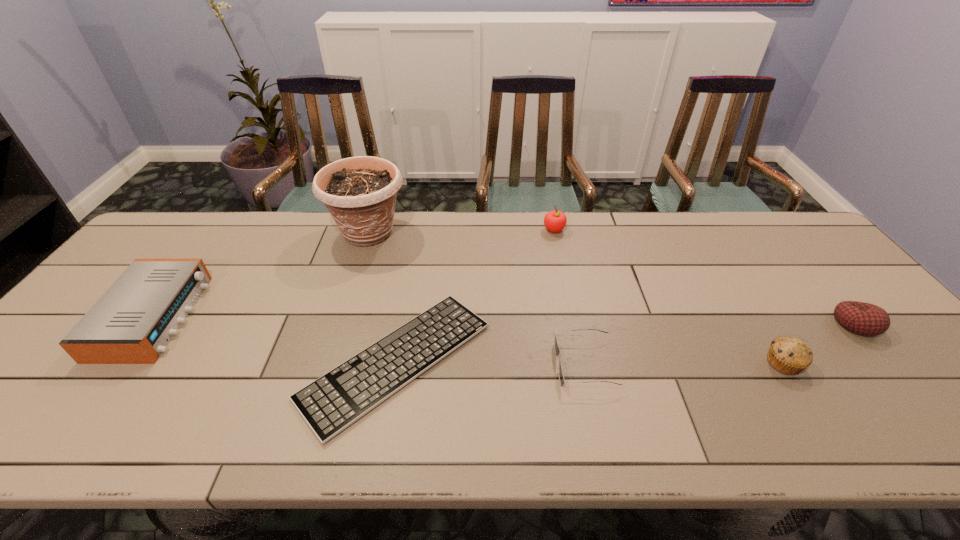
At what (x,y) coordinates should I click in order to perform the action: click on vacant space located 0.320m on the back of the muffin. Please return your answer as a coordinate pair (x, y). Looking at the image, I should click on (721, 264).

This screenshot has height=540, width=960. I want to click on vacant region located on the front of the beanbag, so click(x=883, y=357).

Locate an element on the screen. free space located on the front-facing side of the sixth tallest object is located at coordinates (510, 364).

Locate an element on the screen. The height and width of the screenshot is (540, 960). free location located on the front-facing side of the sixth tallest object is located at coordinates (506, 364).

Locate an element on the screen. The width and height of the screenshot is (960, 540). free space located 0.240m on the front-facing side of the sixth tallest object is located at coordinates (455, 364).

Identify the location of vacant space located 0.090m on the back of the computer keyboard. (412, 275).

What are the coordinates of `flowerpot present at the far edge` in the screenshot? It's located at (360, 192).

Locate an element on the screen. The height and width of the screenshot is (540, 960). apple located in the far edge section of the desktop is located at coordinates (554, 221).

The image size is (960, 540). Find the location of `object at the near edge`. object at the near edge is located at coordinates (333, 402).

You are a GUI agent. You are given a task and a screenshot of the screen. Output one action in this format:
    pyautogui.click(x=<x>, y=<y>)
    Task: Click on the object that is at the left edge
    
    Given the screenshot: What is the action you would take?
    pyautogui.click(x=134, y=320)